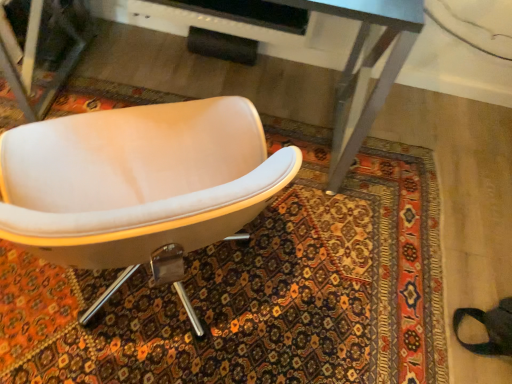
Describe the element at coordinates (364, 69) in the screenshot. I see `metallic gray desk at center` at that location.

Locate an element on the screen. The width and height of the screenshot is (512, 384). metallic gray desk at center is located at coordinates coord(364,69).

What do you see at coordinates (138, 184) in the screenshot?
I see `white leather chair at center` at bounding box center [138, 184].

Where is `white leather chair at center`? The height and width of the screenshot is (384, 512). white leather chair at center is located at coordinates pyautogui.click(x=138, y=184).

Measure the distance between point [201,186] and camera.

The depth of point [201,186] is 37.40 inches.

Find the location of a particular element. metallic gray desk at center is located at coordinates (364, 69).

Which object is positioned more to the left, white leather chair at center or metallic gray desk at center?

From the viewer's perspective, white leather chair at center appears more on the left side.

Between white leather chair at center and metallic gray desk at center, which one is positioned in front?

white leather chair at center.

Is point (15, 146) positioned after point (41, 17)?

No, it is in front of (41, 17).

Consider the image. From the image's perspective, does white leather chair at center appear lower than metallic gray desk at center?

Indeed, from the image's perspective, white leather chair at center is shown beneath metallic gray desk at center.

From a real-world perspective, between white leather chair at center and metallic gray desk at center, who is vertically higher?

white leather chair at center.

Is white leather chair at center wider than metallic gray desk at center?

Yes, white leather chair at center is wider than metallic gray desk at center.

Is white leather chair at center taller than metallic gray desk at center?

Correct, white leather chair at center is much taller as metallic gray desk at center.

Who is bigger, white leather chair at center or metallic gray desk at center?

Bigger between the two is metallic gray desk at center.

Is metallic gray desk at center located within white leather chair at center?

No, white leather chair at center does not contain metallic gray desk at center.

Is white leather chair at center with metallic gray desk at center?

white leather chair at center and metallic gray desk at center are clearly separated.

Is white leather chair at center oriented away from metallic gray desk at center?

No, white leather chair at center's orientation is not away from metallic gray desk at center.

What's the angular difference between white leather chair at center and metallic gray desk at center's facing directions?

154 degrees.

The height and width of the screenshot is (384, 512). Identify the location of desk below the white leather chair at center (from a real-world perspective). (364, 69).

Which is more to the right, metallic gray desk at center or white leather chair at center?

metallic gray desk at center.

Is the position of metallic gray desk at center less distant than that of white leather chair at center?

No, metallic gray desk at center is behind white leather chair at center.

Which point is more distant from viewer, (406, 37) or (166, 148)?

The point (406, 37) is more distant.

From the image's perspective, which is below, metallic gray desk at center or white leather chair at center?

white leather chair at center, from the image's perspective.

From a real-world perspective, between metallic gray desk at center and white leather chair at center, who is vertically lower?

metallic gray desk at center is physically lower.

Is metallic gray desk at center wider or thinner than white leather chair at center?

Clearly, metallic gray desk at center has less width compared to white leather chair at center.

Can you confirm if metallic gray desk at center is shorter than white leather chair at center?

Correct, metallic gray desk at center is not as tall as white leather chair at center.

Can you confirm if metallic gray desk at center is smaller than white leather chair at center?

No, metallic gray desk at center is not smaller than white leather chair at center.

Is white leather chair at center inside metallic gray desk at center?

No.

Is metallic gray desk at center touching white leather chair at center?

No, metallic gray desk at center is not making contact with white leather chair at center.

Is metallic gray desk at center positioned with its back to white leather chair at center?

Yes, metallic gray desk at center is facing away from white leather chair at center.

What's the angular difference between metallic gray desk at center and white leather chair at center's facing directions?

There is a 154-degree angle between the facing directions of metallic gray desk at center and white leather chair at center.

What are the coordinates of `desk on the right of white leather chair at center` in the screenshot? It's located at (364, 69).

You are a GUI agent. You are given a task and a screenshot of the screen. Output one action in this format:
    pyautogui.click(x=<x>, y=<y>)
    Task: Click on the desk lying above the white leather chair at center (from the image's perspective)
    This screenshot has width=512, height=384.
    Given the screenshot: What is the action you would take?
    click(364, 69)

Where is `desk below the white leather chair at center (from a real-world perspective)`? The width and height of the screenshot is (512, 384). desk below the white leather chair at center (from a real-world perspective) is located at coordinates (364, 69).